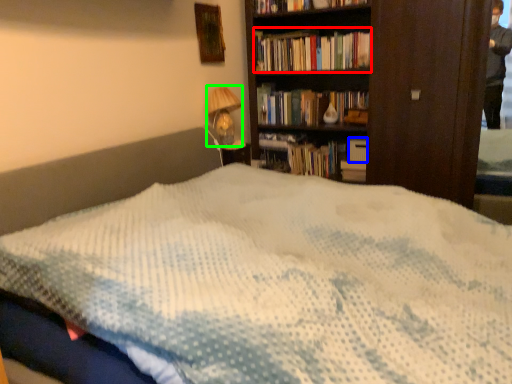
Question: Based on their relative distances, which object is farther from book (highlighted by a red box)? Choose from paperback book (highlighted by a blue box) and table lamp (highlighted by a green box).

Choices:
 (A) paperback book
 (B) table lamp

Answer: (A)